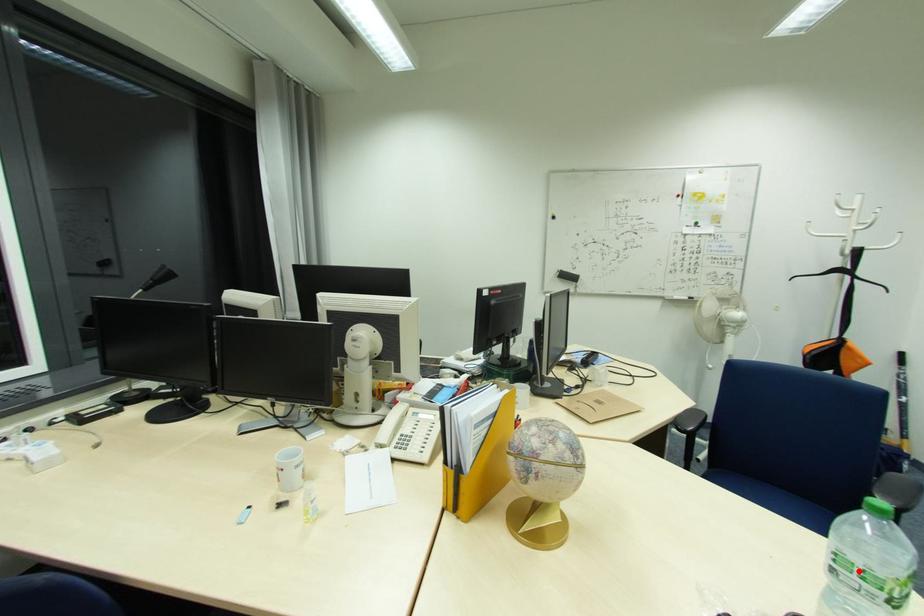
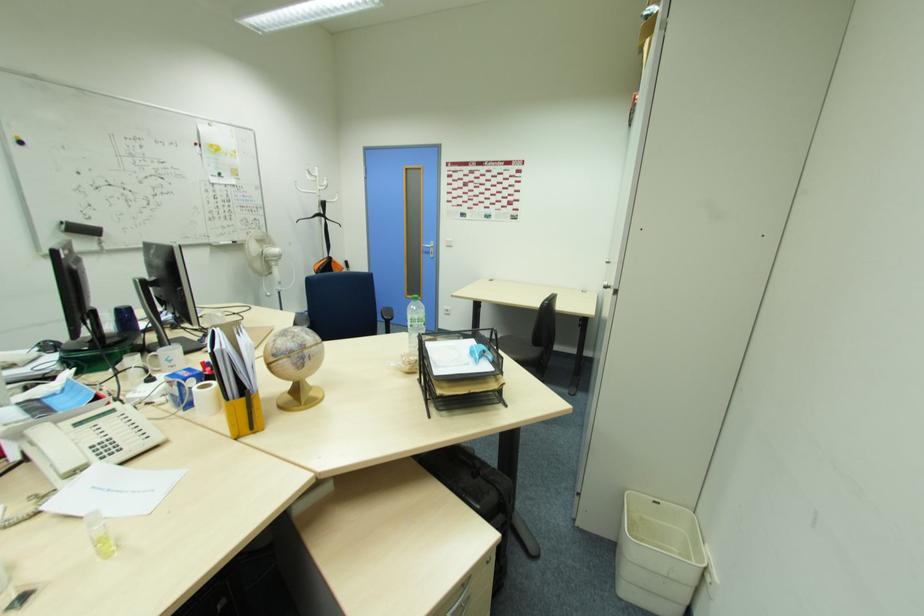
Question: I am providing you with two images of the same scene from different viewpoints. Given a red point in image1, look at the same physical point in image2. Is it:

Choices:
 (A) Closer to the viewpoint
 (B) Farther from the viewpoint

Answer: (B)